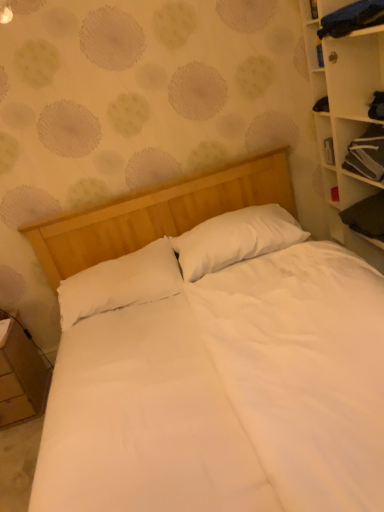
Question: Is the depth of black fabric cabinet at upper right greater than that of white soft pillow at center, placed as the first pillow when sorted from left to right?

Choices:
 (A) no
 (B) yes

Answer: (A)

Question: Is black fabric cabinet at upper right positioned with its back to white soft pillow at center, arranged as the 2th pillow when viewed from the right?

Choices:
 (A) yes
 (B) no

Answer: (B)

Question: Is black fabric cabinet at upper right positioned beyond the bounds of white soft pillow at center, arranged as the 2th pillow when viewed from the right?

Choices:
 (A) yes
 (B) no

Answer: (A)

Question: Is black fabric cabinet at upper right to the left of white soft pillow at center, arranged as the 2th pillow when viewed from the right, from the viewer's perspective?

Choices:
 (A) no
 (B) yes

Answer: (A)

Question: Can you confirm if black fabric cabinet at upper right is positioned to the right of white soft pillow at center, arranged as the 2th pillow when viewed from the right?

Choices:
 (A) no
 (B) yes

Answer: (B)

Question: Based on their sizes in the image, would you say white wood bookcase at right is bigger or smaller than white soft pillow at center, placed as the first pillow when sorted from left to right?

Choices:
 (A) big
 (B) small

Answer: (A)

Question: Which is correct: white wood bookcase at right is inside white soft pillow at center, arranged as the 2th pillow when viewed from the right, or outside of it?

Choices:
 (A) outside
 (B) inside

Answer: (A)

Question: In the image, is white wood bookcase at right positioned in front of or behind white soft pillow at center, arranged as the 2th pillow when viewed from the right?

Choices:
 (A) behind
 (B) front

Answer: (B)

Question: From a real-world perspective, is white wood bookcase at right above or below white soft pillow at center, arranged as the 2th pillow when viewed from the right?

Choices:
 (A) above
 (B) below

Answer: (A)

Question: Is black fabric cabinet at upper right in front of or behind white wood bookcase at right in the image?

Choices:
 (A) front
 (B) behind

Answer: (B)

Question: From the image's perspective, relative to white wood bookcase at right, is black fabric cabinet at upper right above or below?

Choices:
 (A) above
 (B) below

Answer: (A)

Question: Considering the positions of black fabric cabinet at upper right and white wood bookcase at right in the image, is black fabric cabinet at upper right taller or shorter than white wood bookcase at right?

Choices:
 (A) short
 (B) tall

Answer: (A)

Question: From a real-world perspective, is black fabric cabinet at upper right physically located above or below white wood bookcase at right?

Choices:
 (A) below
 (B) above

Answer: (B)

Question: From a real-world perspective, relative to white soft pillow at center, placed as the first pillow when sorted from left to right, is wooden nightstand at lower left vertically above or below?

Choices:
 (A) above
 (B) below

Answer: (B)

Question: Is wooden nightstand at lower left to the left or to the right of white soft pillow at center, placed as the first pillow when sorted from left to right, in the image?

Choices:
 (A) right
 (B) left

Answer: (B)